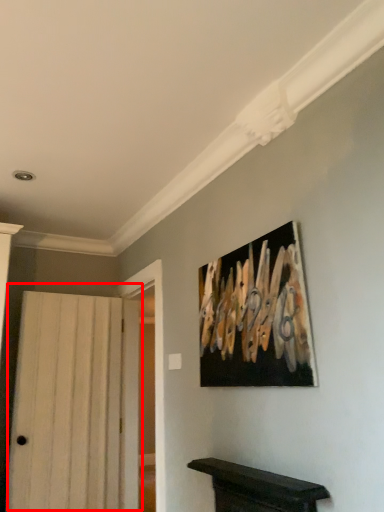
Question: Considering the relative positions of door (annotated by the red box) and picture frame in the image provided, where is door (annotated by the red box) located with respect to the staircase?

Choices:
 (A) right
 (B) left

Answer: (B)